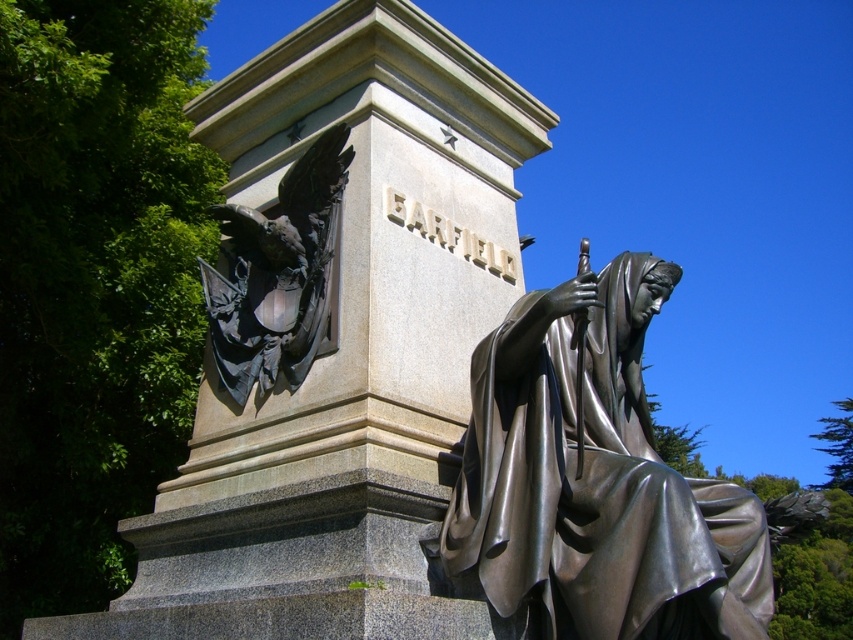
Question: Which point is closer to the camera?

Choices:
 (A) bronze statue at center
 (B) polished bronze eagle at left

Answer: (A)

Question: Can you confirm if bronze statue at center is thinner than polished bronze eagle at left?

Choices:
 (A) yes
 (B) no

Answer: (B)

Question: Which object is closer to the camera taking this photo?

Choices:
 (A) polished bronze eagle at left
 (B) bronze statue at center

Answer: (B)

Question: Is bronze statue at center below polished bronze eagle at left?

Choices:
 (A) yes
 (B) no

Answer: (A)

Question: Is bronze statue at center positioned behind polished bronze eagle at left?

Choices:
 (A) yes
 (B) no

Answer: (B)